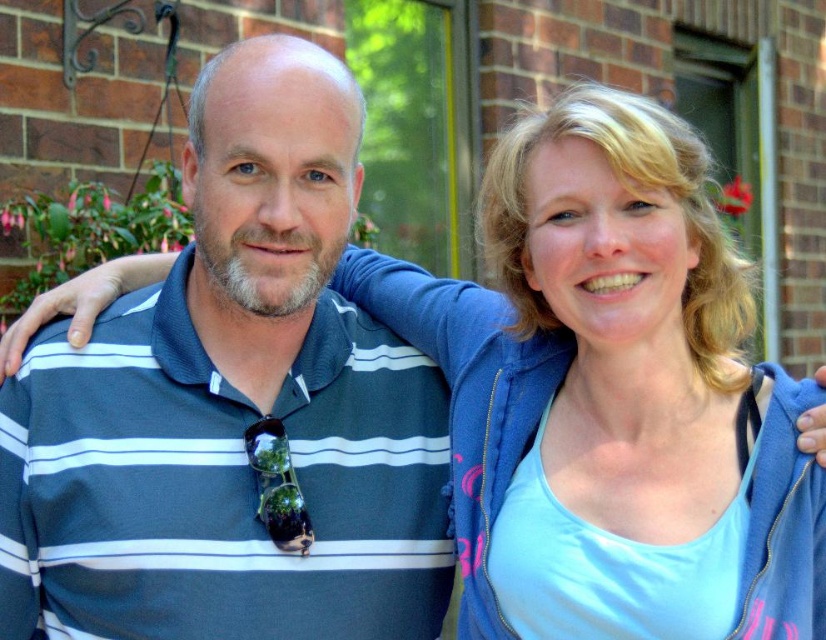
Question: Is dark blue striped polo shirt at left behind blue fleece jacket at upper right?

Choices:
 (A) yes
 (B) no

Answer: (A)

Question: Does dark blue striped polo shirt at left have a smaller size compared to blue fleece jacket at upper right?

Choices:
 (A) yes
 (B) no

Answer: (A)

Question: Does dark blue striped polo shirt at left have a larger size compared to blue fleece jacket at upper right?

Choices:
 (A) yes
 (B) no

Answer: (B)

Question: Which object appears closest to the camera in this image?

Choices:
 (A) dark blue striped polo shirt at left
 (B) blue fleece jacket at upper right

Answer: (B)

Question: Among these objects, which one is farthest from the camera?

Choices:
 (A) blue fleece jacket at upper right
 (B) dark blue striped polo shirt at left

Answer: (B)

Question: Which of the following is the closest to the observer?

Choices:
 (A) (573, 378)
 (B) (55, 627)

Answer: (B)